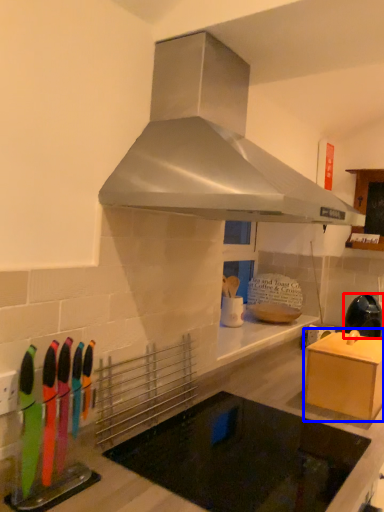
Question: Which point is closer to the camera, kitchen appliance (highlighted by a red box) or cabinetry (highlighted by a blue box)?

Choices:
 (A) kitchen appliance
 (B) cabinetry

Answer: (B)